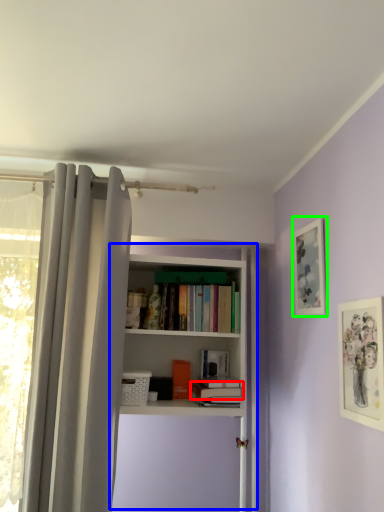
Question: Which object is positioned farthest from book (highlighted by a red box)? Select from shelf (highlighted by a blue box) and picture frame (highlighted by a green box).

Choices:
 (A) shelf
 (B) picture frame

Answer: (B)